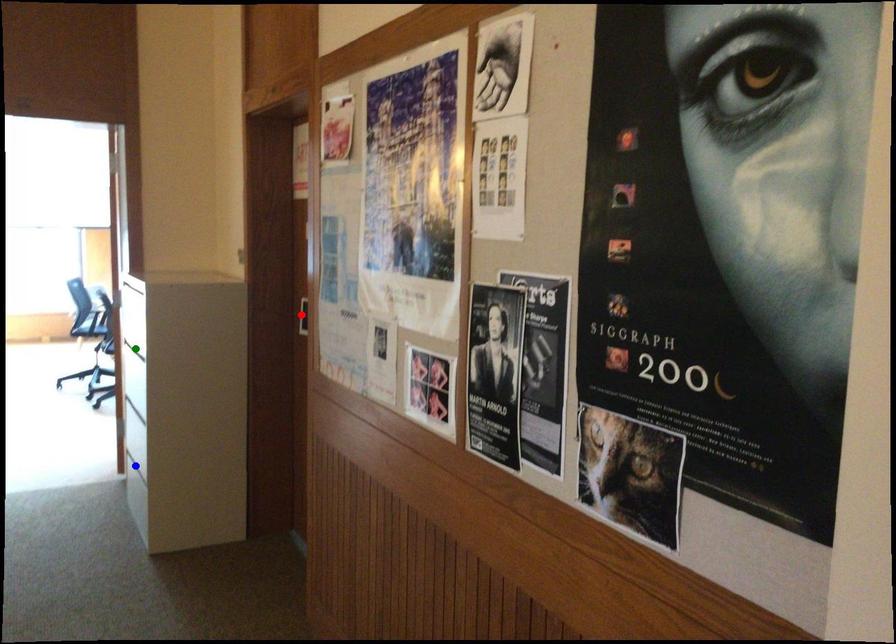
Order these from nearest to farthest:
blue point, green point, red point

1. red point
2. green point
3. blue point